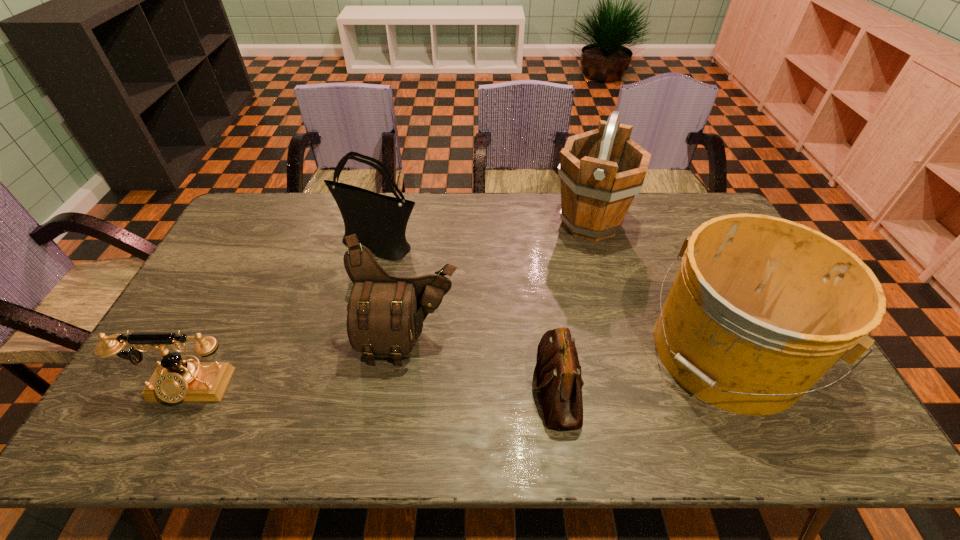
You are a GUI agent. You are given a task and a screenshot of the screen. Output one action in this format:
    pyautogui.click(x=<x>, y=<y>)
    Task: Click on the tallest object
    
    Given the screenshot: What is the action you would take?
    pyautogui.click(x=601, y=171)

Locate an element on the screen. The height and width of the screenshot is (540, 960). the farther bucket is located at coordinates (601, 171).

Locate an element on the screen. the farthest shoulder bag is located at coordinates (379, 221).

Identify the location of the nearer bucket. The height and width of the screenshot is (540, 960). (761, 308).

Identify the location of telephone. The width and height of the screenshot is (960, 540). (175, 380).

In order to click on the shortest shoulder bag in this screenshot , I will do `click(557, 374)`.

Locate an element on the screen. This screenshot has width=960, height=540. free space located 0.280m on the front of the tallest object is located at coordinates (616, 316).

Where is `free spot located 0.190m on the back of the farthest shoulder bag`? free spot located 0.190m on the back of the farthest shoulder bag is located at coordinates (390, 199).

The width and height of the screenshot is (960, 540). What are the coordinates of `free space located 0.320m on the left of the shorter bucket` in the screenshot? It's located at (530, 352).

Identify the location of vacant space located on the dial of the telephone. (157, 447).